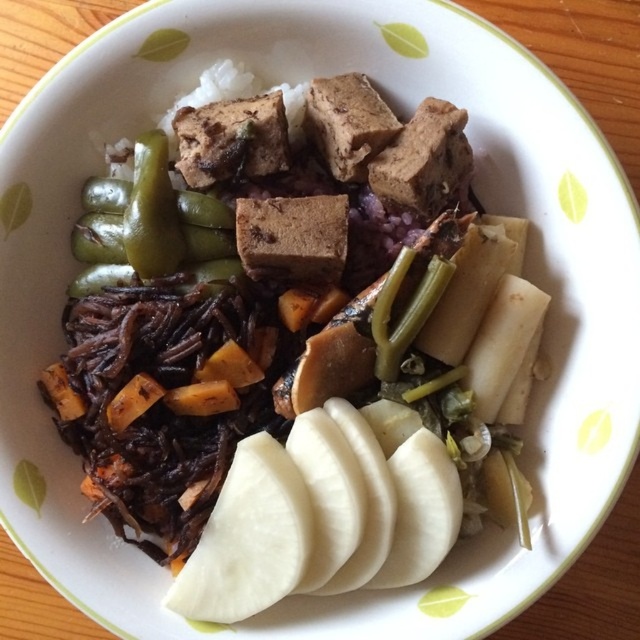
You are a food stylist arranging ingredients in a bowl. You have the white matte sliced potatoes at lower center and the green glossy pepper at upper left. Which ingredient is placed higher up in the bowl?

The green glossy pepper at upper left is placed higher up in the bowl since the white matte sliced potatoes at lower center are positioned under it.

You are a chef preparing a dish and need to know the size of the ingredients. Which of the two ingredients, the white matte sliced potatoes at lower center or the green glossy pepper at upper left, is larger in size?

The white matte sliced potatoes at lower center is bigger than the green glossy pepper at upper left according to the description.

You are standing in front of the bowl of food. You need to reach a point that is exactly 1.2 meters away from you to retrieve an ingredient. Is the point at coordinates point (472, 241) within your reach?

The point (472, 241) is 1.28 meters from the camera, so it is slightly out of reach since you need to reach exactly 1.2 meters.